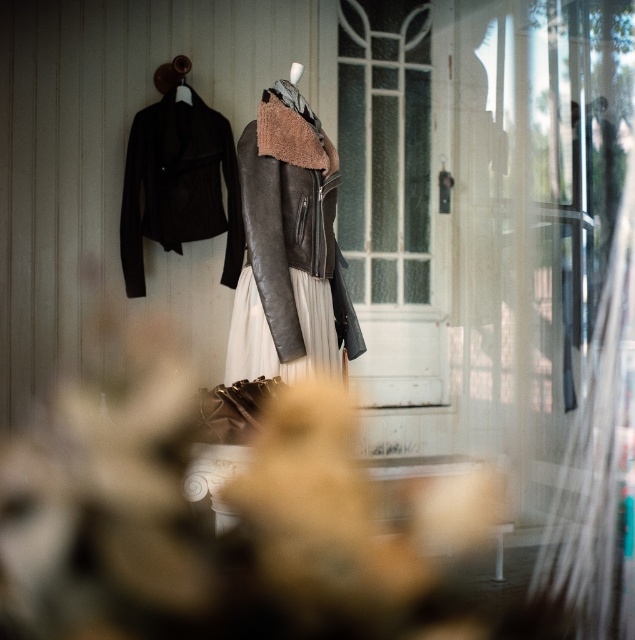
Is matte black leather jacket at left above leather dress at center?

Yes, matte black leather jacket at left is above leather dress at center.

Can you confirm if matte black leather jacket at left is shorter than leather dress at center?

Incorrect, matte black leather jacket at left's height does not fall short of leather dress at center's.

The height and width of the screenshot is (640, 635). Describe the element at coordinates (178, 186) in the screenshot. I see `matte black leather jacket at left` at that location.

I want to click on matte black leather jacket at left, so click(x=178, y=186).

The image size is (635, 640). What do you see at coordinates (384, 148) in the screenshot?
I see `matte black leather jacket at center` at bounding box center [384, 148].

Who is shorter, matte black leather jacket at center or matte black leather jacket at left?

With less height is matte black leather jacket at left.

Does point (368, 298) come closer to viewer compared to point (144, 112)?

No, it is behind (144, 112).

Locate an element on the screen. Image resolution: width=635 pixels, height=640 pixels. matte black leather jacket at center is located at coordinates (384, 148).

Between matte black leather jacket at center and leather jacket at center, which one appears on the right side from the viewer's perspective?

Positioned to the right is matte black leather jacket at center.

Does matte black leather jacket at center have a greater width compared to leather jacket at center?

Indeed, matte black leather jacket at center has a greater width compared to leather jacket at center.

Where is `matte black leather jacket at center`? This screenshot has width=635, height=640. matte black leather jacket at center is located at coordinates (384, 148).